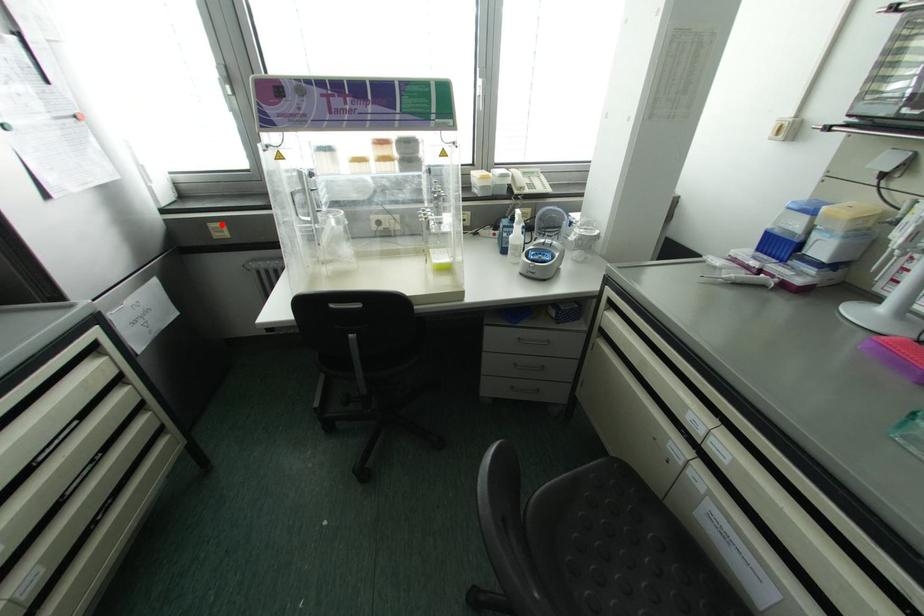
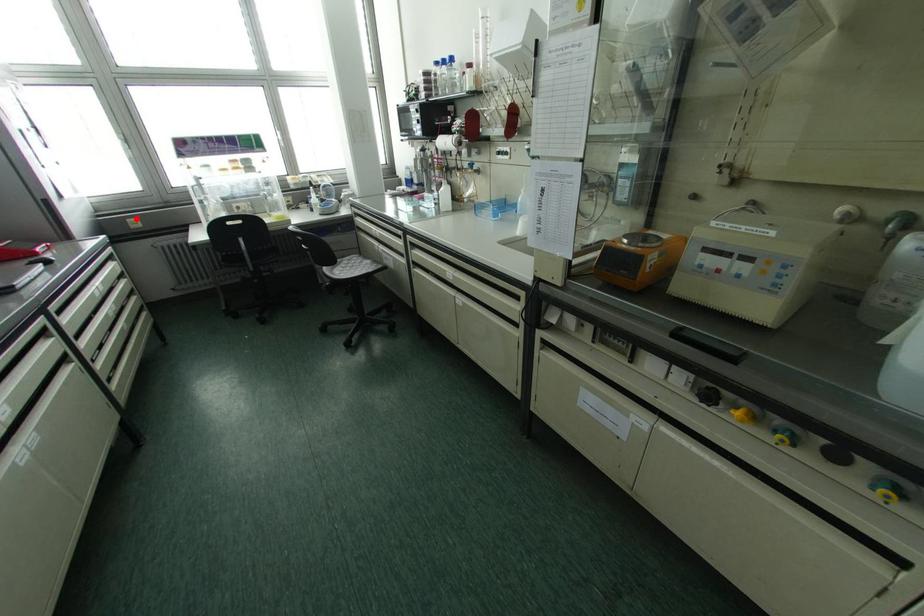
I am providing you with two images of the same scene from different viewpoints. A red point is marked on the first image and another point is marked on the second image. Is the marked point in image1 the same physical position as the marked point in image2?

Yes